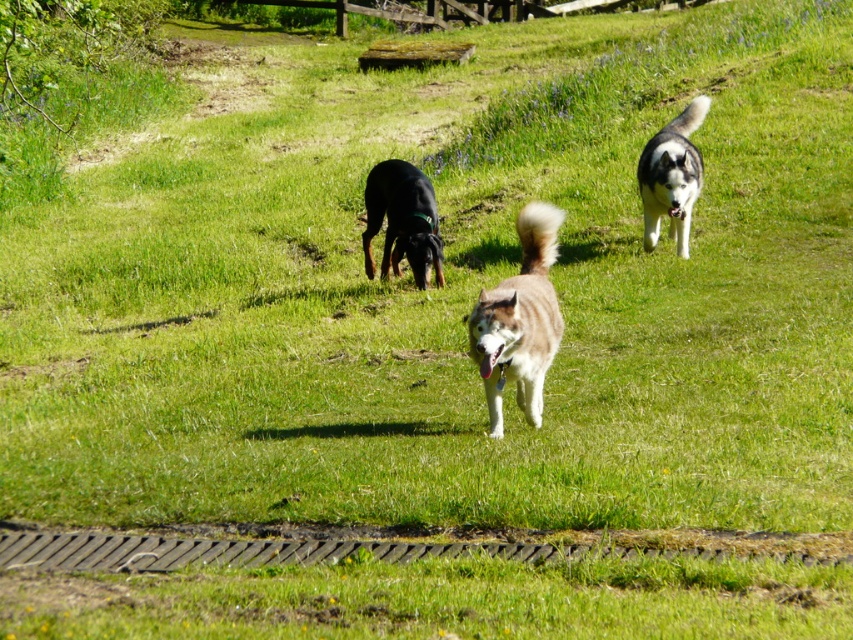
Looking at this image, you are standing in the grassy area and see the brown fur dog at center. If you want to throw a ball to it, will you need to throw it over 6 meters?

The brown fur dog at center is 6.12 meters away from the viewer, so yes, you need to throw the ball over 6 meters to reach it.